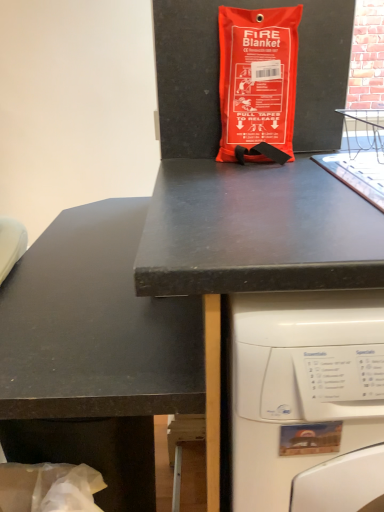
Question: From the image's perspective, is orange fabric fire blanket at center above or below black matte desk at upper center?

Choices:
 (A) below
 (B) above

Answer: (B)

Question: Is orange fabric fire blanket at center in front of or behind black matte desk at upper center in the image?

Choices:
 (A) behind
 (B) front

Answer: (A)

Question: Which object is the farthest from the black matte counter top at center?

Choices:
 (A) orange fabric fire blanket at center
 (B) black matte desk at upper center

Answer: (A)

Question: Considering the real-world distances, which object is closest to the black matte desk at upper center?

Choices:
 (A) orange fabric fire blanket at center
 (B) black matte counter top at center

Answer: (B)